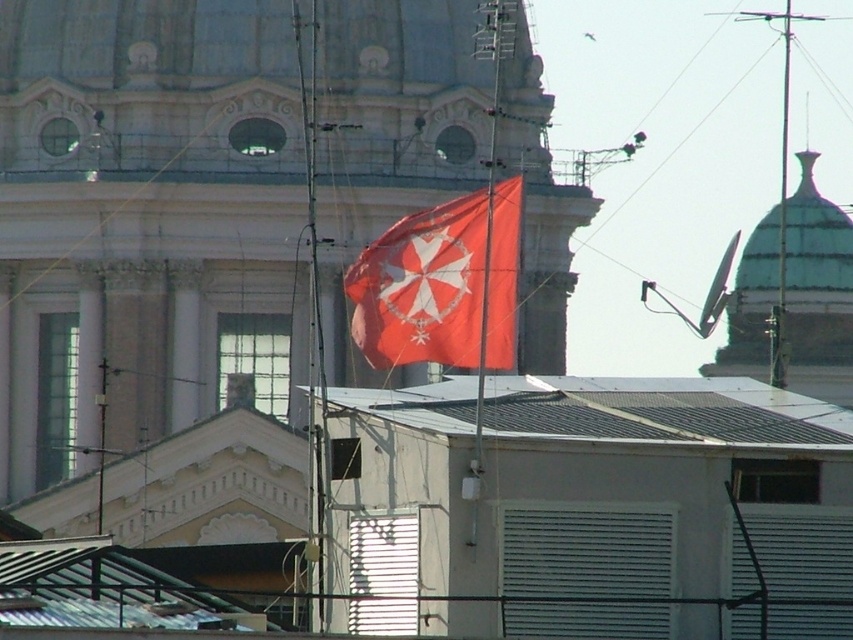
Based on the photo, you are standing in front of the classical building with the green glazed dome at upper right and the modern building with the matte red flag at center. Which object is positioned higher in the image?

The green glazed dome at upper right is positioned higher in the image than the matte red flag at center.

Looking at this image, you are standing in front of the classical building with the dome and columns. You see the gray metal roof at center and the green glazed dome at upper right. Which object is positioned to the left when viewed from your perspective?

The gray metal roof at center is positioned to the left of the green glazed dome at upper right.